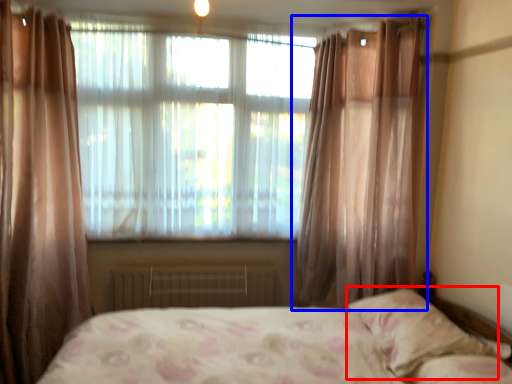
Question: Among these objects, which one is farthest to the camera, pillow (highlighted by a red box) or curtain (highlighted by a blue box)?

Choices:
 (A) pillow
 (B) curtain

Answer: (B)